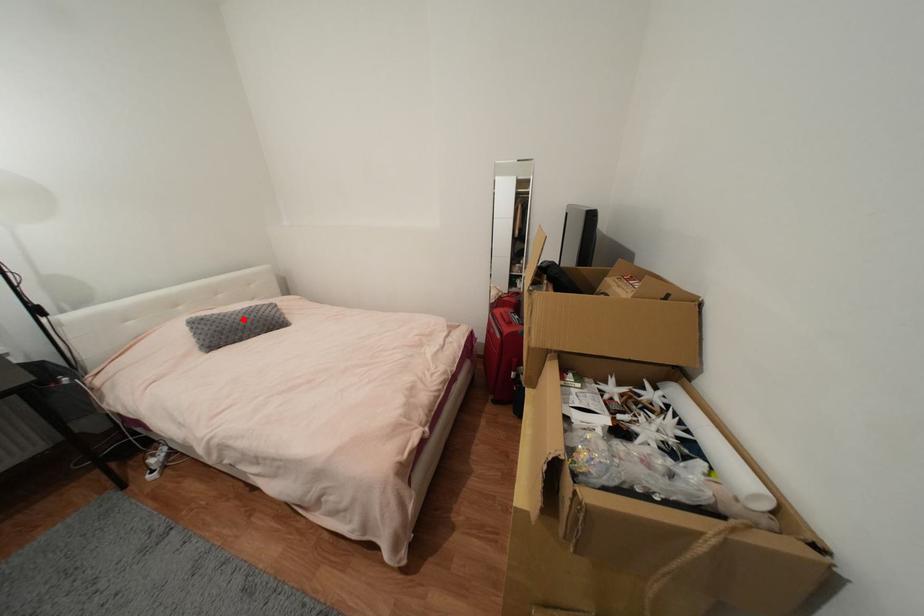
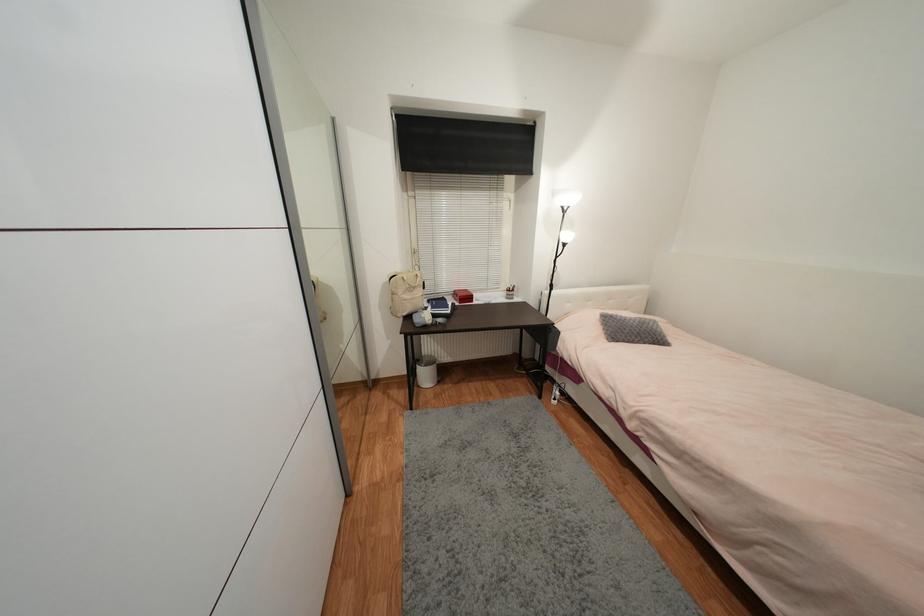
In the second image, find the point that corresponds to the highlighted location in the first image.

(639, 326)